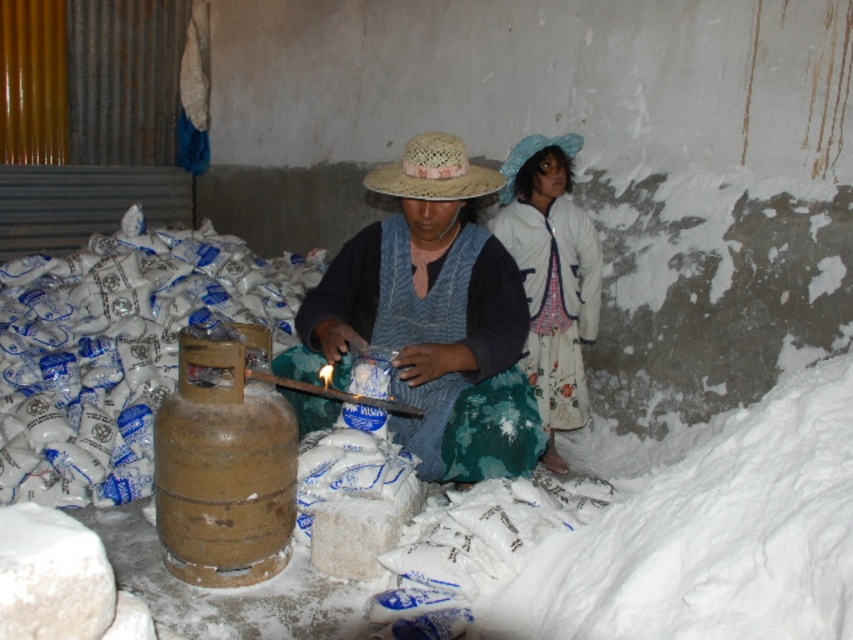
Question: Does white cotton dress at upper right come in front of straw hat at center?

Choices:
 (A) yes
 (B) no

Answer: (B)

Question: Does knitted straw hat at center appear on the left side of straw hat at center?

Choices:
 (A) yes
 (B) no

Answer: (A)

Question: Among these points, which one is nearest to the camera?

Choices:
 (A) (555, 419)
 (B) (422, 168)
 (C) (384, 294)

Answer: (B)

Question: Among these objects, which one is nearest to the camera?

Choices:
 (A) knitted straw hat at center
 (B) straw hat at center
 (C) white cotton dress at upper right

Answer: (A)

Question: Among these objects, which one is nearest to the camera?

Choices:
 (A) white cotton dress at upper right
 (B) knitted straw hat at center
 (C) straw hat at center

Answer: (B)

Question: Considering the relative positions of knitted straw hat at center and white cotton dress at upper right in the image provided, where is knitted straw hat at center located with respect to white cotton dress at upper right?

Choices:
 (A) below
 (B) above

Answer: (A)